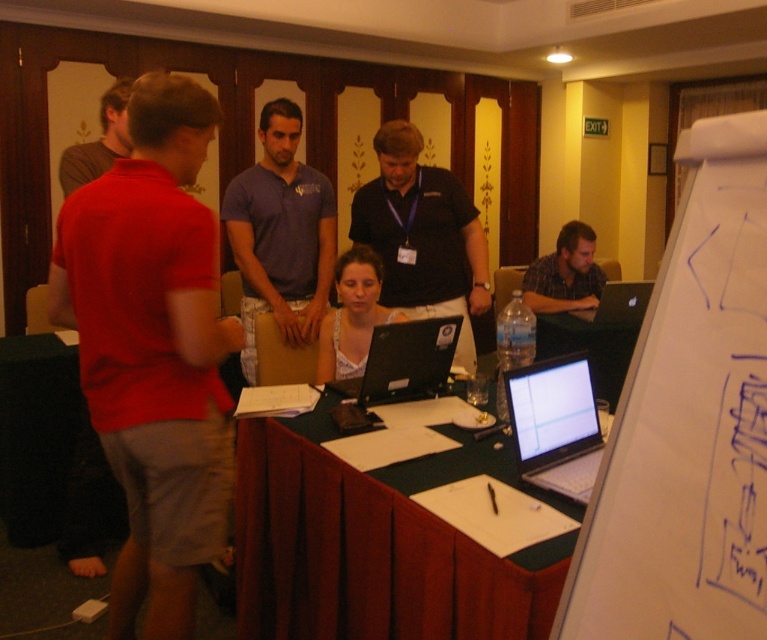
Question: Considering the relative positions of matte blue shirt at center and white lace top at center in the image provided, where is matte blue shirt at center located with respect to white lace top at center?

Choices:
 (A) left
 (B) right

Answer: (A)

Question: Which of the following is the farthest from the observer?

Choices:
 (A) matte red shirt at left
 (B) black glossy laptop at center

Answer: (A)

Question: Among these objects, which one is farthest from the camera?

Choices:
 (A) silver metallic laptop at right
 (B) white lace top at center

Answer: (A)

Question: Which of these objects is positioned farthest from the matte blue shirt at center?

Choices:
 (A) silver metallic laptop at center
 (B) red cotton polo shirt at left

Answer: (A)

Question: Considering the relative positions of matte blue shirt at center and white lace top at center in the image provided, where is matte blue shirt at center located with respect to white lace top at center?

Choices:
 (A) above
 (B) below

Answer: (A)

Question: Does matte red shirt at left appear over silver metallic laptop at right?

Choices:
 (A) no
 (B) yes

Answer: (B)